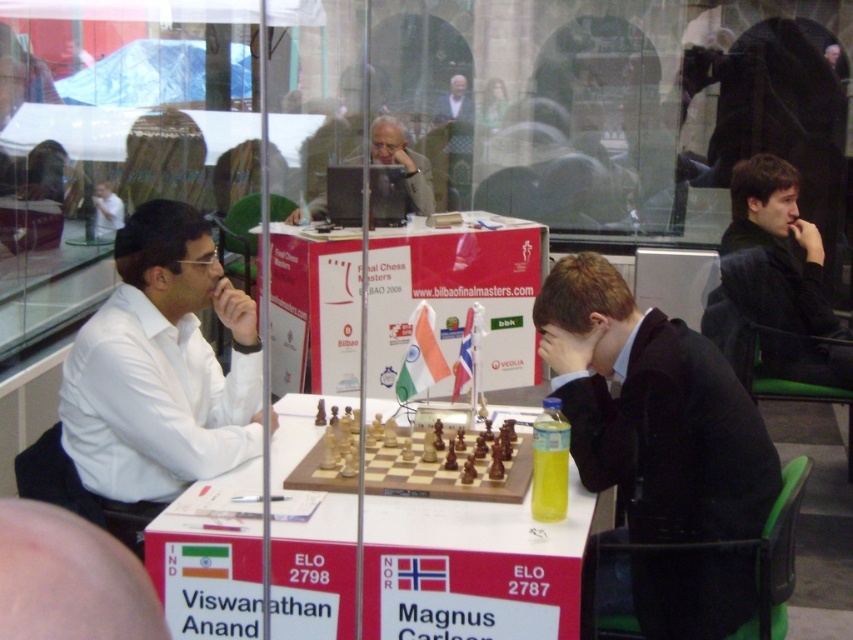
Image resolution: width=853 pixels, height=640 pixels. Describe the element at coordinates (473, 568) in the screenshot. I see `wooden at center` at that location.

Based on the photo, is wooden at center to the right of black suit at center from the viewer's perspective?

No, wooden at center is not to the right of black suit at center.

Describe the element at coordinates (473, 568) in the screenshot. The height and width of the screenshot is (640, 853). I see `wooden at center` at that location.

Locate an element on the screen. This screenshot has width=853, height=640. wooden at center is located at coordinates (473, 568).

Does white shirt at left have a smaller size compared to wooden chessboard at center?

Actually, white shirt at left might be larger than wooden chessboard at center.

Between white shirt at left and wooden chessboard at center, which one has more height?

white shirt at left is taller.

Identify the location of white shirt at left. (160, 369).

The width and height of the screenshot is (853, 640). What are the coordinates of `white shirt at left` in the screenshot? It's located at (160, 369).

Between white shirt at left and matte black laptop at upper center, which one appears on the left side from the viewer's perspective?

white shirt at left is more to the left.

Does point (199, 296) lie in front of point (428, 188)?

Yes, point (199, 296) is in front of point (428, 188).

Where is `white shirt at left`? The image size is (853, 640). white shirt at left is located at coordinates (160, 369).